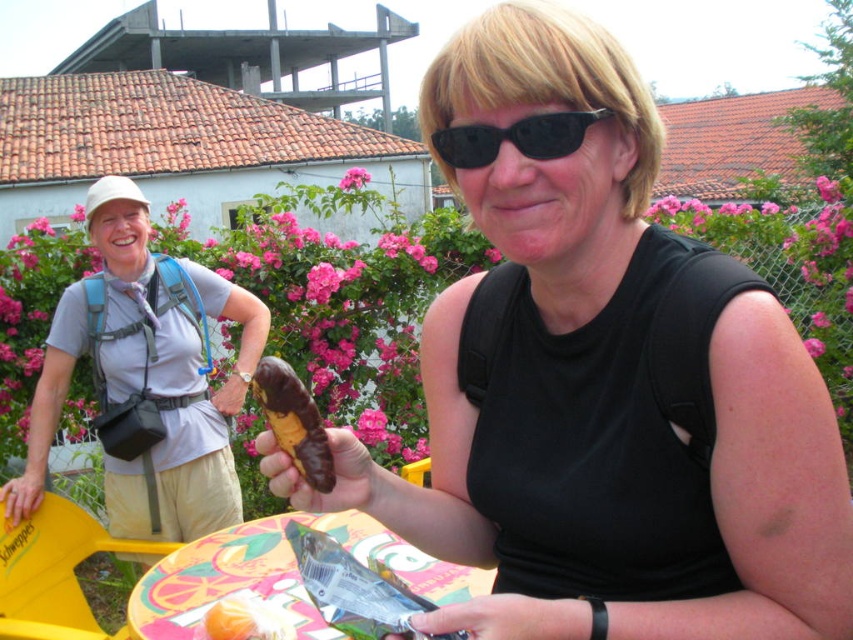
Does point (474, 572) lie behind point (305, 429)?

That is True.

Is painted wood table at center below chocolate-coated banana at center?

Yes, painted wood table at center is below chocolate-coated banana at center.

Locate an element on the screen. The height and width of the screenshot is (640, 853). painted wood table at center is located at coordinates (279, 573).

The image size is (853, 640). Identify the location of painted wood table at center. point(279,573).

Measure the distance between gray fabric backpack at left and camera.

gray fabric backpack at left is 2.73 meters from camera.

Can you confirm if gray fabric backpack at left is bigger than painted wood table at center?

Yes, gray fabric backpack at left is bigger than painted wood table at center.

Locate an element on the screen. The image size is (853, 640). gray fabric backpack at left is located at coordinates (146, 376).

Does matte chocolate banana at center have a greater height compared to gray fabric backpack at left?

No.

Is matte chocolate banana at center behind gray fabric backpack at left?

No, it is not.

Describe the element at coordinates (601, 392) in the screenshot. I see `matte chocolate banana at center` at that location.

You are a GUI agent. You are given a task and a screenshot of the screen. Output one action in this format:
    pyautogui.click(x=<x>, y=<y>)
    Task: Click on the matte chocolate banana at center
    Image resolution: width=853 pixels, height=640 pixels.
    Given the screenshot: What is the action you would take?
    pyautogui.click(x=601, y=392)